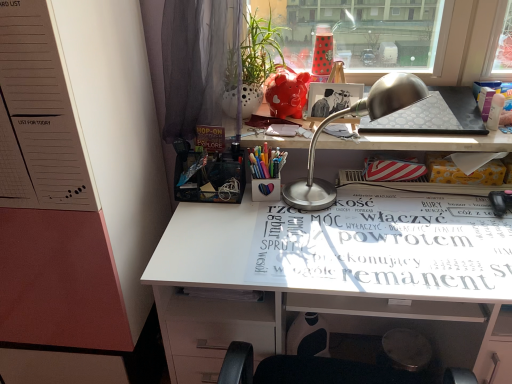
Locate an element on the screen. This screenshot has height=384, width=512. free spot above white glossy desk at center (from a real-world perspective) is located at coordinates (356, 231).